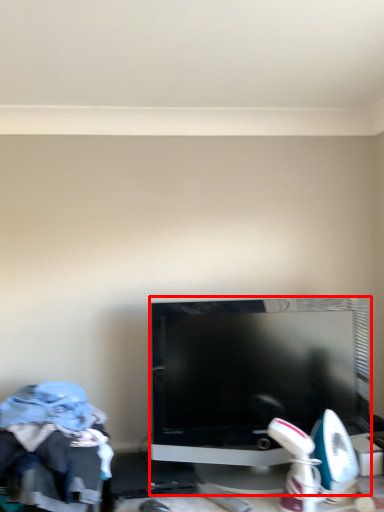
Question: Where is television (annotated by the red box) located in relation to clothing in the image?

Choices:
 (A) left
 (B) right

Answer: (B)